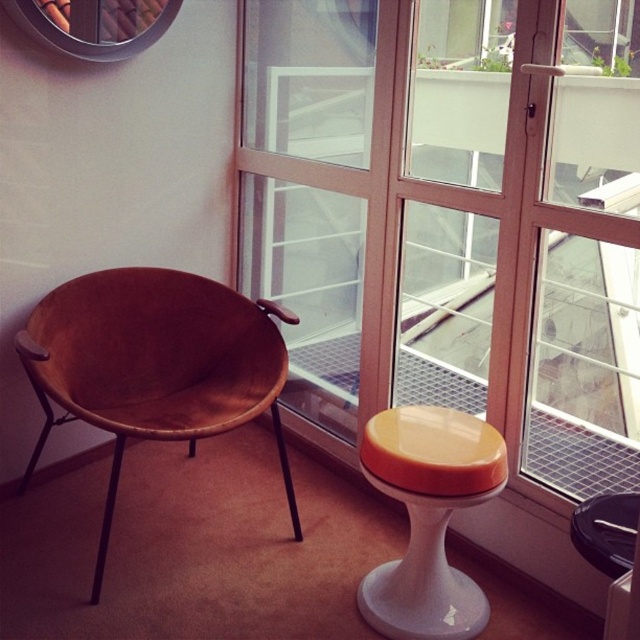
Question: Does transparent glass window at center have a smaller size compared to brown leather swivel chair at left?

Choices:
 (A) yes
 (B) no

Answer: (B)

Question: Which point is farther to the camera?

Choices:
 (A) (627, 45)
 (B) (236, 307)

Answer: (B)

Question: Which is farther from the orange glossy stool at lower right?

Choices:
 (A) brown leather swivel chair at left
 (B) transparent glass window at center

Answer: (A)

Question: Is transparent glass window at center thinner than brown leather swivel chair at left?

Choices:
 (A) no
 (B) yes

Answer: (A)

Question: In this image, where is brown leather swivel chair at left located relative to orange glossy stool at lower right?

Choices:
 (A) below
 (B) above

Answer: (B)

Question: Which object is the closest to the transparent glass window at center?

Choices:
 (A) brown leather swivel chair at left
 (B) orange glossy stool at lower right

Answer: (B)